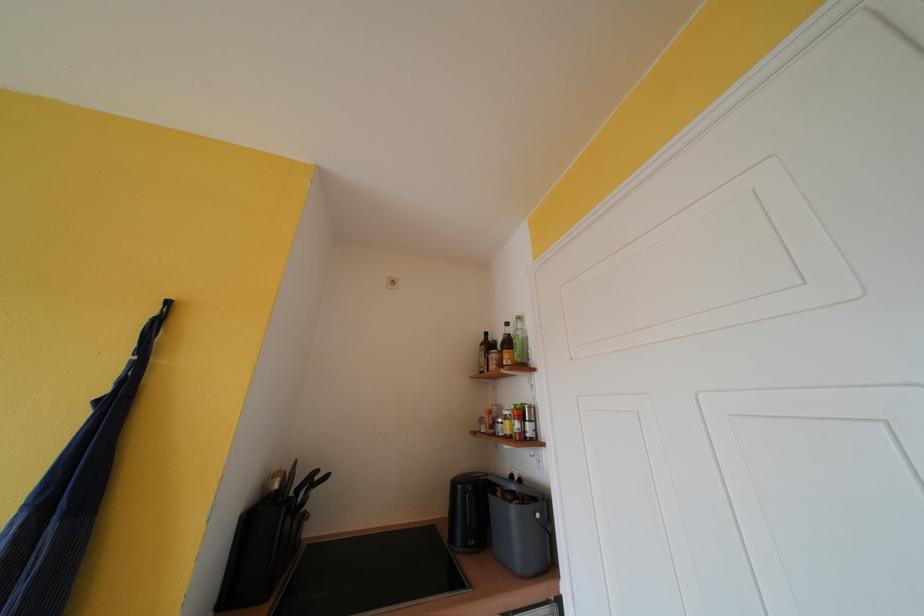
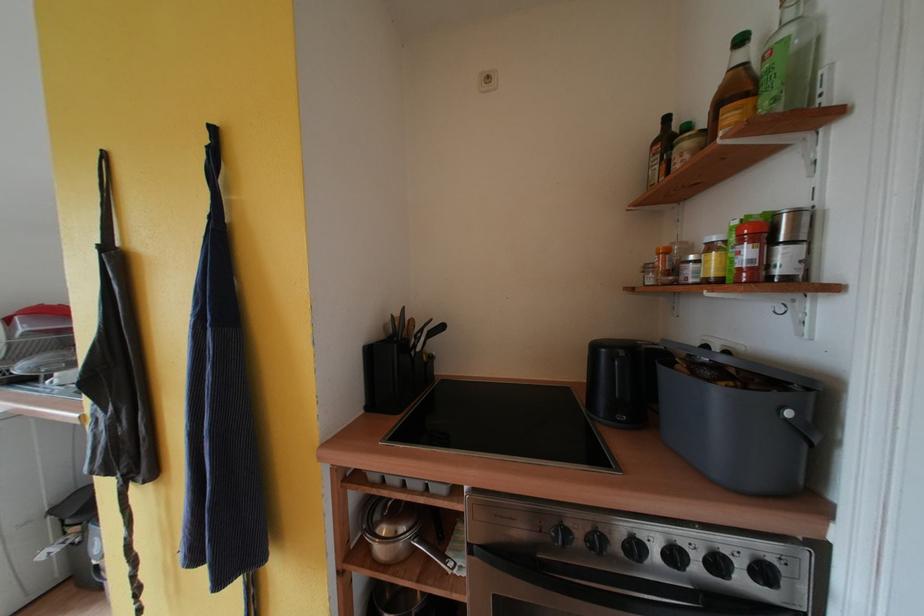
Find the pixel in the second image that matches the point at 524,428 in the first image.

(755, 256)